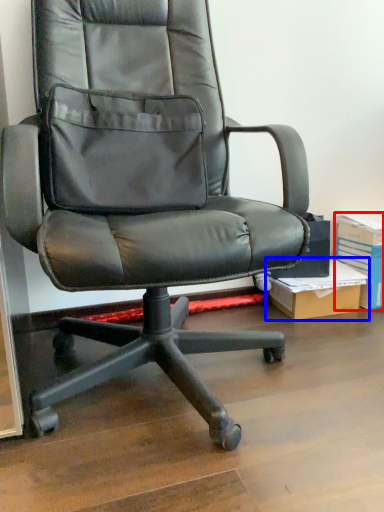
Question: Which point is closer to the camera, paperback book (highlighted by a red box) or cardboard box (highlighted by a blue box)?

Choices:
 (A) paperback book
 (B) cardboard box

Answer: (B)